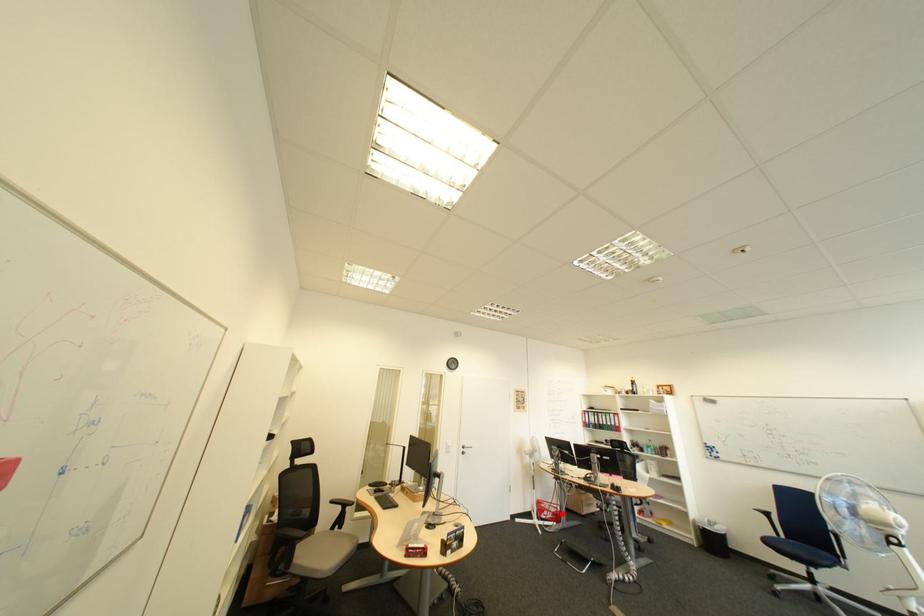
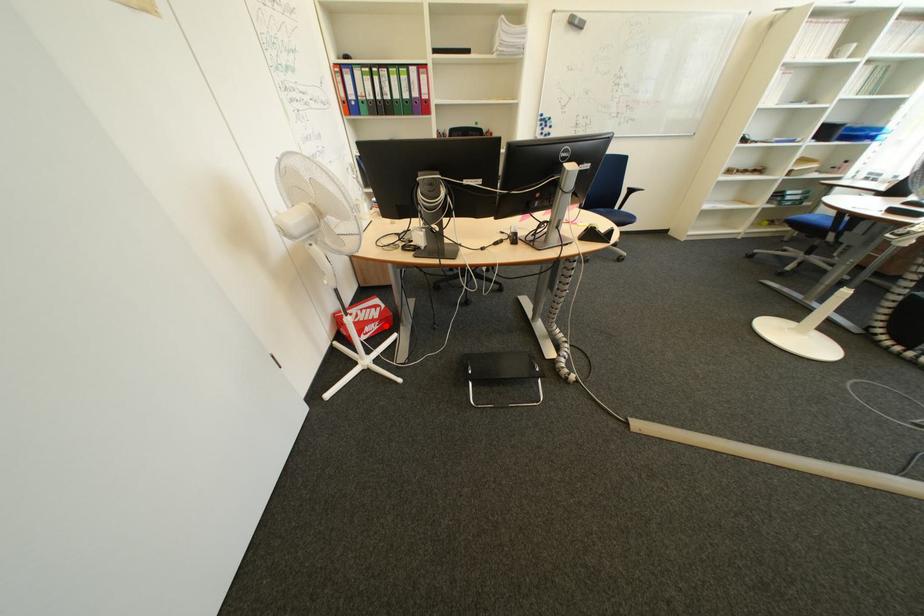
I am providing you with two images of the same scene from different viewpoints. A red point is marked on the first image and another point is marked on the second image. Does the point marked in image1 correspond to the same location as the one in image2?

Yes